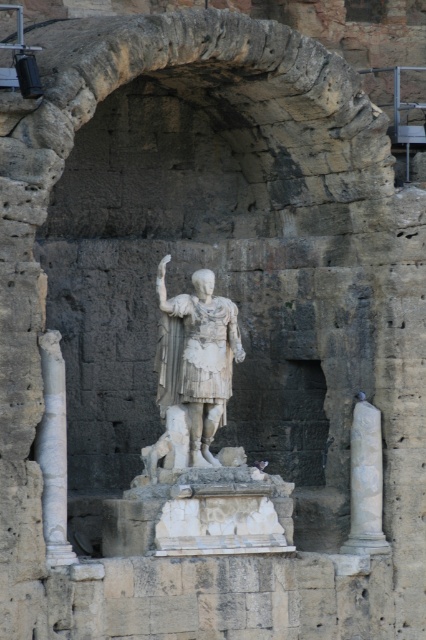
Question: Can you confirm if white marble column at left is bigger than white marble column at right?

Choices:
 (A) no
 (B) yes

Answer: (A)

Question: Which of the following is the closest to the observer?

Choices:
 (A) white marble column at right
 (B) white marble statue at center
 (C) white marble column at left

Answer: (C)

Question: Which of these objects is positioned farthest from the white marble column at right?

Choices:
 (A) white marble column at left
 (B) white marble statue at center

Answer: (A)

Question: Does white marble statue at center come in front of white marble column at right?

Choices:
 (A) yes
 (B) no

Answer: (A)

Question: Does white marble statue at center come in front of white marble column at left?

Choices:
 (A) yes
 (B) no

Answer: (B)

Question: Which object is the farthest from the white marble statue at center?

Choices:
 (A) white marble column at left
 (B) white marble column at right

Answer: (B)